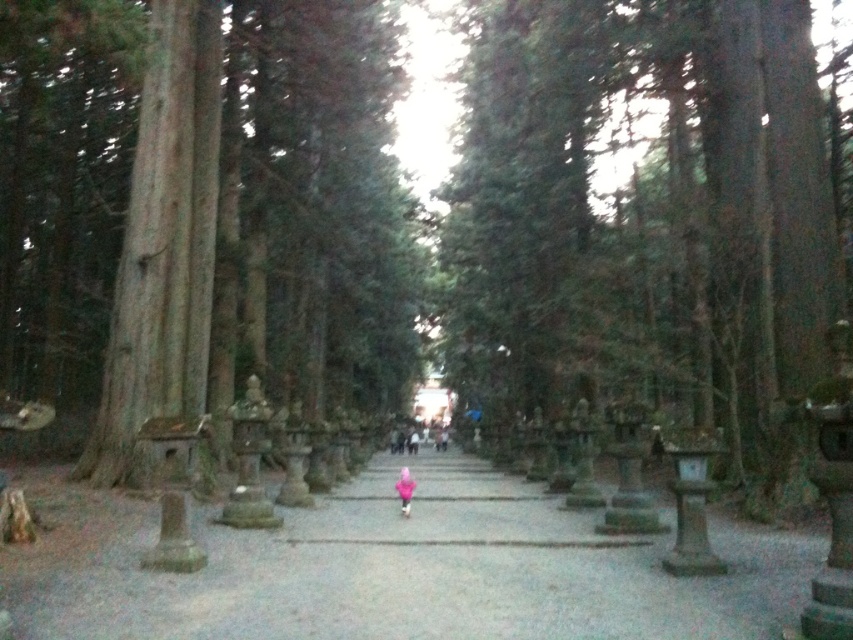
You are a painter standing at the entrance of the pathway. You want to paint the smooth brown tree trunk at left and the pink fabric at center. Which object is wider?

The pink fabric at center is wider than the smooth brown tree trunk at left.

You are a hiker carrying a 40 meter long rope. You want to use it to measure the distance between the smooth brown tree trunk at left and the pink fabric at center. Will the rope be long enough?

The distance between the smooth brown tree trunk at left and the pink fabric at center is 38.65 meters, so the 40 meter rope will be long enough to measure the distance between them.